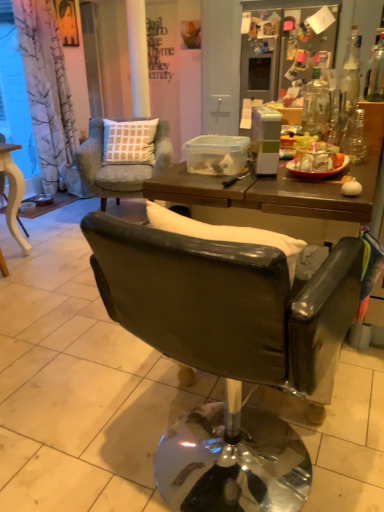
Question: Can you confirm if brown wooden table at center is taller than clear glass bottle at upper right, the 1th bottle positioned from the left?

Choices:
 (A) yes
 (B) no

Answer: (B)

Question: Is brown wooden table at center not close to clear glass bottle at upper right, the 1th bottle positioned from the left?

Choices:
 (A) yes
 (B) no

Answer: (B)

Question: Can you confirm if brown wooden table at center is thinner than clear glass bottle at upper right, the 3th bottle from the right?

Choices:
 (A) yes
 (B) no

Answer: (B)

Question: Considering the relative sizes of brown wooden table at center and clear glass bottle at upper right, the 1th bottle positioned from the left, in the image provided, is brown wooden table at center bigger than clear glass bottle at upper right, the 1th bottle positioned from the left,?

Choices:
 (A) yes
 (B) no

Answer: (A)

Question: From the image's perspective, does brown wooden table at center appear lower than clear glass bottle at upper right, the 1th bottle positioned from the left?

Choices:
 (A) yes
 (B) no

Answer: (A)

Question: Is brown wooden table at center smaller than clear glass bottle at upper right, the 1th bottle positioned from the left?

Choices:
 (A) no
 (B) yes

Answer: (A)

Question: From the image's perspective, does transparent glass bottle at upper right, the 1th bottle viewed from the right, appear lower than brown wooden table at center?

Choices:
 (A) yes
 (B) no

Answer: (B)

Question: From the image's perspective, is transparent glass bottle at upper right, which ranks as the third bottle in left-to-right order, over brown wooden table at center?

Choices:
 (A) no
 (B) yes

Answer: (B)

Question: Is transparent glass bottle at upper right, which ranks as the third bottle in left-to-right order, beside brown wooden table at center?

Choices:
 (A) yes
 (B) no

Answer: (B)

Question: Is brown wooden table at center located within transparent glass bottle at upper right, which ranks as the third bottle in left-to-right order?

Choices:
 (A) yes
 (B) no

Answer: (B)

Question: Does transparent glass bottle at upper right, which ranks as the third bottle in left-to-right order, have a greater height compared to brown wooden table at center?

Choices:
 (A) yes
 (B) no

Answer: (B)

Question: Is transparent glass bottle at upper right, which ranks as the third bottle in left-to-right order, bigger than brown wooden table at center?

Choices:
 (A) yes
 (B) no

Answer: (B)

Question: From the image's perspective, is light blue fabric chair at upper left, which is the 1th chair in back-to-front order, below brown wooden table at center?

Choices:
 (A) no
 (B) yes

Answer: (A)